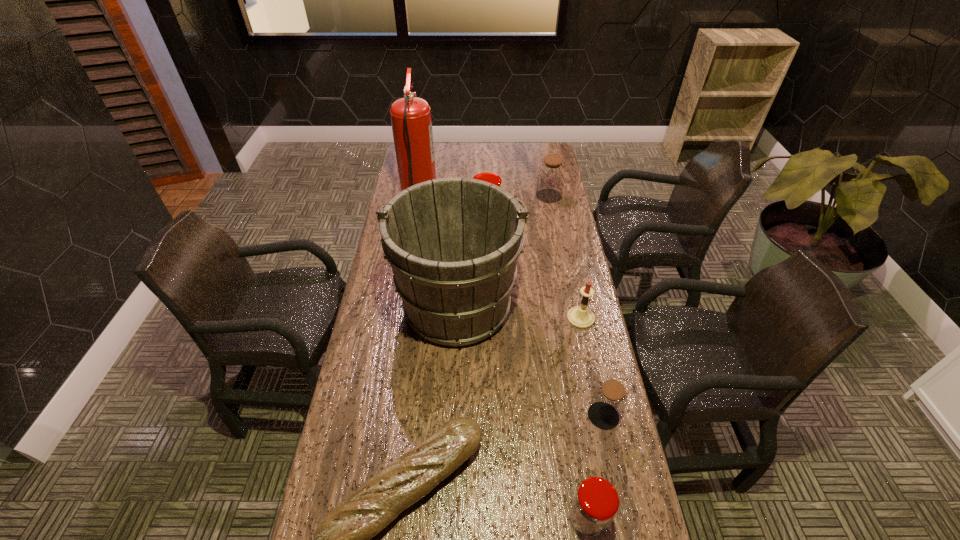
Where is `vacant area situated 0.180m on the instruction side of the red fire extinguisher`? The width and height of the screenshot is (960, 540). vacant area situated 0.180m on the instruction side of the red fire extinguisher is located at coordinates (478, 198).

The image size is (960, 540). Find the location of `vacant space located on the handle side of the bucket`. vacant space located on the handle side of the bucket is located at coordinates (462, 212).

Where is `free space located on the handle side of the bucket`? free space located on the handle side of the bucket is located at coordinates [x=463, y=199].

The width and height of the screenshot is (960, 540). I want to click on free location located on the handle side of the bucket, so click(x=461, y=241).

Identify the location of vacant space located 0.350m on the left of the bigger brown jar. [x=457, y=196].

Identify the location of vacant space positioned 0.120m on the front of the bigger red jar. This screenshot has height=540, width=960. (487, 245).

In order to click on free point located on the back of the red candle in this screenshot , I will do `click(574, 288)`.

Image resolution: width=960 pixels, height=540 pixels. I want to click on free space located on the back of the nearer brown jar, so click(x=594, y=374).

In order to click on fire extinguisher located at the left edge in this screenshot , I will do `click(411, 121)`.

This screenshot has width=960, height=540. Identify the location of bucket present at the left edge. (453, 244).